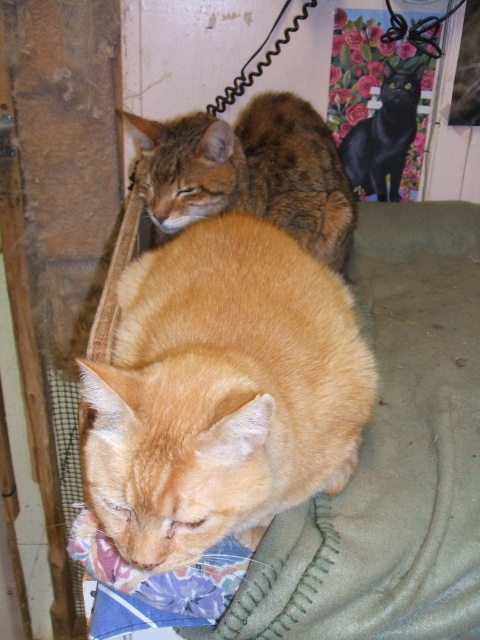
You are a cat owner who wants to place a new toy between the orange fur cat at center and the tabby fur cat at upper left. The toy requires a minimum of 18 inches of space to function properly. Based on the scene, can the toy be placed between them?

The distance between the orange fur cat at center and the tabby fur cat at upper left is 17.94 inches, which is slightly less than the required 18 inches. Therefore, the toy cannot be placed between them as it won not have enough space to function properly.

You are a photographer trying to capture a closeup of the tabby fur cat at upper left and the black glossy cat at upper center. Since you want the cats to be in focus, which cat should you focus on first to ensure the closest possible focus?

The tabby fur cat at upper left is closer to the viewer than the black glossy cat at upper center, so you should focus on the tabby fur cat at upper left first to ensure the closest possible focus.

You are a photographer trying to capture both the orange fur cat at center and the tabby fur cat at upper left in a single shot. Based on their sizes in the image, which cat would you need to position closer to the camera to ensure both fit comfortably in the frame?

The orange fur cat at center occupies less space than the tabby fur cat at upper left. To ensure both fit comfortably in the frame, you should position the orange fur cat at center closer to the camera since it is smaller and requires less space, allowing the larger tabby fur cat at upper left to be farther back without overcrowding the frame.